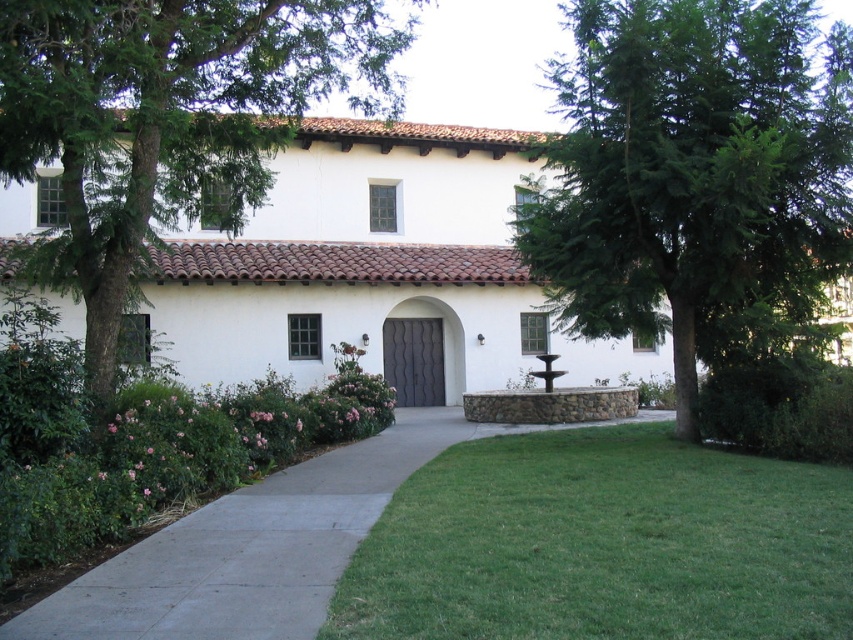
Question: Which point appears farthest from the camera in this image?

Choices:
 (A) (4, 86)
 (B) (289, 516)
 (C) (712, 314)
 (D) (534, 632)

Answer: (C)

Question: Is green grass at lower center positioned in front of green leafy tree at left?

Choices:
 (A) yes
 (B) no

Answer: (A)

Question: Which point is closer to the camera?

Choices:
 (A) concrete at center
 (B) green leafy tree at center
 (C) green leafy tree at left

Answer: (A)

Question: Which of the following is the farthest from the observer?

Choices:
 (A) (115, 368)
 (B) (640, 419)
 (C) (532, 269)

Answer: (B)

Question: Is green grass at lower center in front of green leafy tree at left?

Choices:
 (A) yes
 (B) no

Answer: (A)

Question: Can you confirm if green grass at lower center is positioned to the right of green leafy tree at left?

Choices:
 (A) yes
 (B) no

Answer: (A)